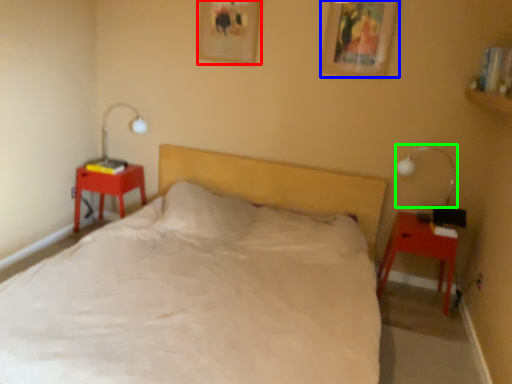
Question: Which is nearer to the picture frame (highlighted by a red box)? picture frame (highlighted by a blue box) or bedside lamp (highlighted by a green box).

Choices:
 (A) picture frame
 (B) bedside lamp

Answer: (A)